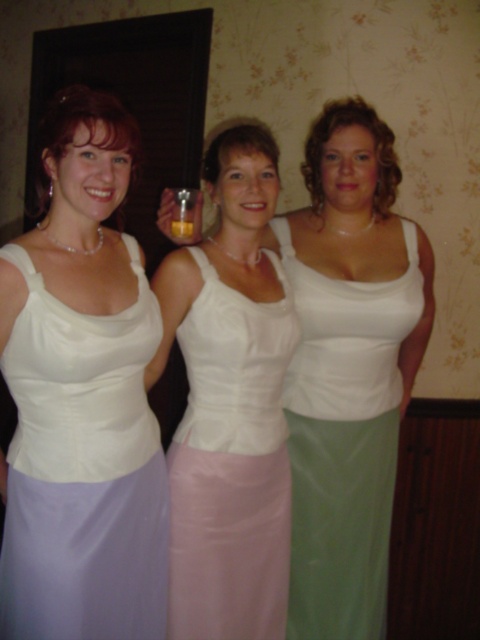
Can you confirm if matte white tank top at center is positioned above satin white dress at center?

Indeed, matte white tank top at center is positioned over satin white dress at center.

Is matte white tank top at center to the left of satin white dress at center from the viewer's perspective?

No, matte white tank top at center is not to the left of satin white dress at center.

Measure the distance between point (x=333, y=166) and camera.

1.62 meters

Locate an element on the screen. matte white tank top at center is located at coordinates (348, 368).

Which is in front, point (323, 452) or point (336, 340)?

Point (336, 340)

Is point (394, 182) less distant than point (372, 424)?

That is False.

Find the location of a particular element. Image resolution: width=480 pixels, height=640 pixels. matte white tank top at center is located at coordinates (348, 368).

How far apart are matte white dress at left and white satin dress at center?

matte white dress at left and white satin dress at center are 52.96 centimeters apart from each other.

Which is more to the left, matte white dress at left or white satin dress at center?

matte white dress at left is more to the left.

I want to click on matte white dress at left, so click(x=83, y=468).